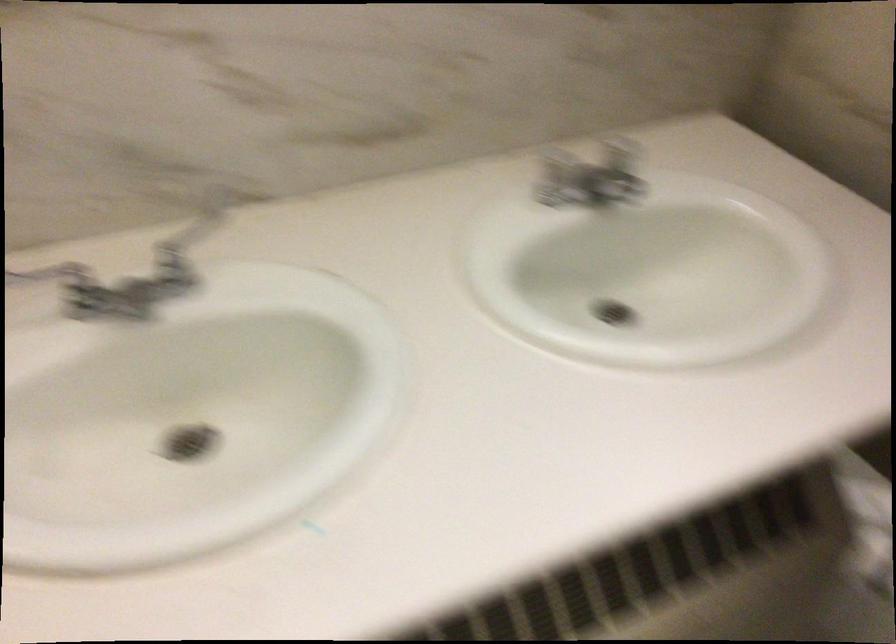
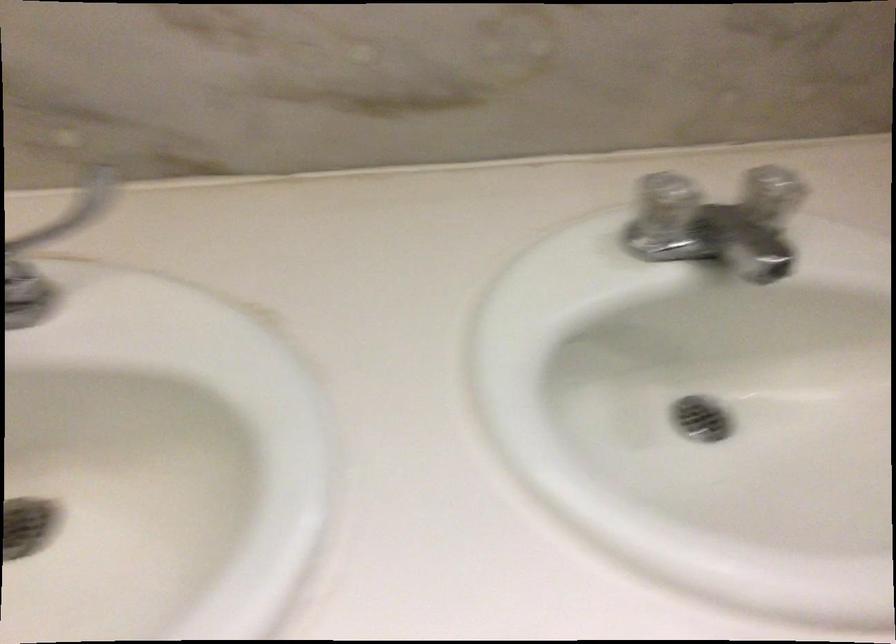
Question: How did the camera likely rotate?

Choices:
 (A) Left
 (B) Right
 (C) Up
 (D) Down

Answer: (D)